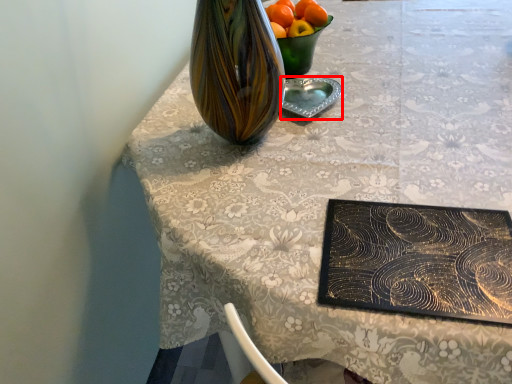
Question: Where is tableware (annotated by the red box) located in relation to orange in the image?

Choices:
 (A) right
 (B) left

Answer: (A)